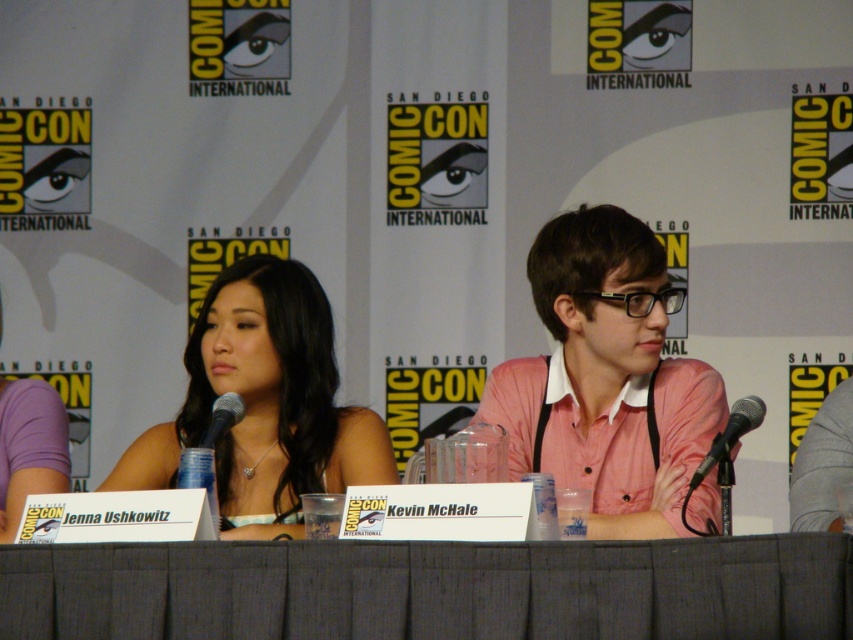
Question: Estimate the real-world distances between objects in this image. Which object is closer to the black matte microphone at center?

Choices:
 (A) gray fabric table at center
 (B) matte black dress at center
 (C) black metallic microphone at center

Answer: (B)

Question: Which object appears closest to the camera in this image?

Choices:
 (A) black matte microphone at center
 (B) pink cotton shirt at center
 (C) black metallic microphone at center
 (D) gray fabric table at center

Answer: (D)

Question: Is the position of black metallic microphone at center less distant than that of black matte microphone at center?

Choices:
 (A) no
 (B) yes

Answer: (B)

Question: Does black metallic microphone at center appear on the right side of black matte microphone at center?

Choices:
 (A) yes
 (B) no

Answer: (A)

Question: Is gray fabric table at center to the left of matte black dress at center from the viewer's perspective?

Choices:
 (A) no
 (B) yes

Answer: (A)

Question: Based on their relative distances, which object is farther from the pink cotton shirt at center?

Choices:
 (A) black matte microphone at center
 (B) matte black dress at center
 (C) gray fabric table at center
 (D) black metallic microphone at center

Answer: (C)